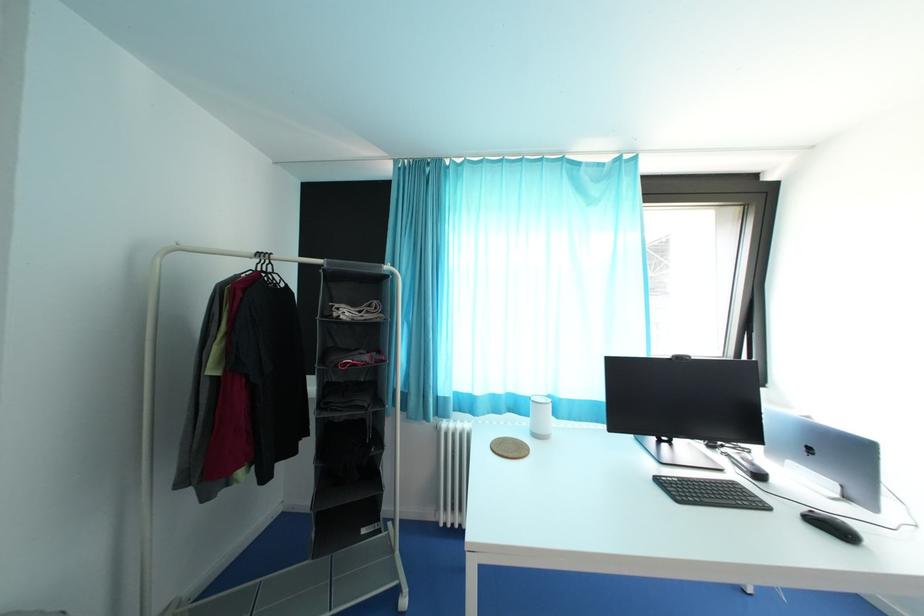
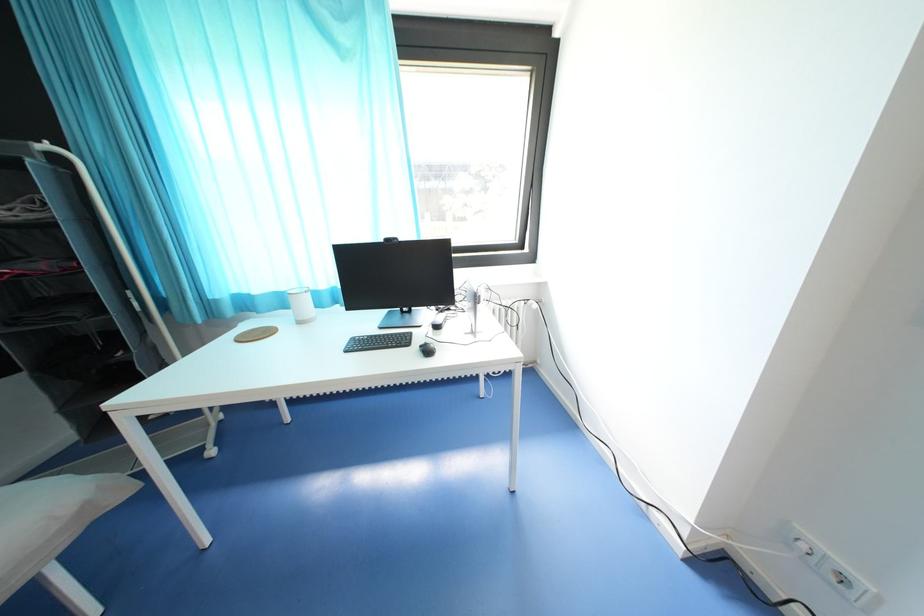
Question: What movement of the cameraman would produce the second image?

Choices:
 (A) Left
 (B) Right
 (C) Forward
 (D) Backward

Answer: (B)